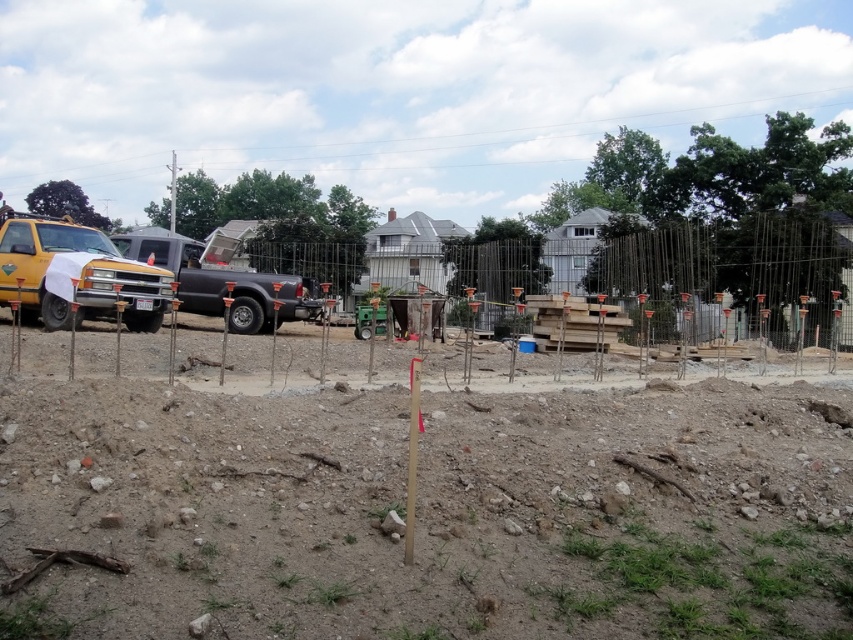
Which is behind, point (112, 305) or point (271, 300)?

The point (271, 300) is behind.

This screenshot has height=640, width=853. Describe the element at coordinates (74, 275) in the screenshot. I see `matte yellow truck at left` at that location.

Image resolution: width=853 pixels, height=640 pixels. What are the coordinates of `matte yellow truck at left` in the screenshot? It's located at (74, 275).

Is point (219, 412) behind point (57, 256)?

No, (219, 412) is closer to viewer.

Between point (535, 563) and point (132, 260), which one is positioned in front?

Point (535, 563) is more forward.

The image size is (853, 640). Describe the element at coordinates (433, 513) in the screenshot. I see `brown sandy soil at center` at that location.

Locate an element on the screen. brown sandy soil at center is located at coordinates (433, 513).

At what (x,y) coordinates should I click in order to perform the action: click on brown sandy soil at center. Please return your answer as a coordinate pair (x, y). This screenshot has width=853, height=640. Looking at the image, I should click on (433, 513).

Which is above, brown sandy soil at center or black matte truck at center?

black matte truck at center is higher up.

Which is in front, point (801, 408) or point (257, 332)?

Point (801, 408)

At what (x,y) coordinates should I click in order to perform the action: click on brown sandy soil at center. Please return your answer as a coordinate pair (x, y). Looking at the image, I should click on (433, 513).